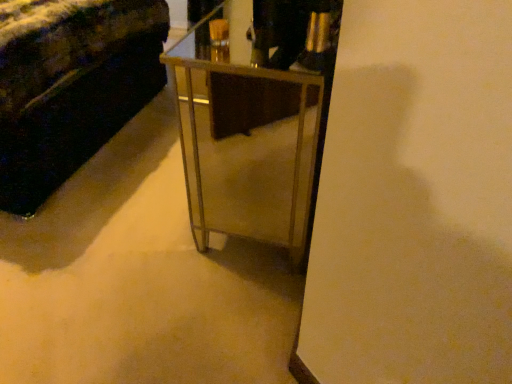
The image size is (512, 384). I want to click on vacant space in front of metallic gold table at center, so click(x=200, y=315).